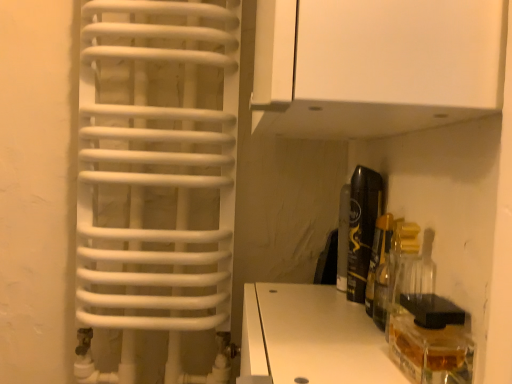
What do you see at coordinates (362, 228) in the screenshot? The height and width of the screenshot is (384, 512). I see `black glossy can at right, the 2th bottle positioned from the front` at bounding box center [362, 228].

This screenshot has height=384, width=512. Find the location of `white matte cabinet at upper center`. white matte cabinet at upper center is located at coordinates pos(375,65).

Between clear glass bottle at center right, acting as the 2th bottle starting from the back, and white matte cabinet at upper center, which one has less height?

With less height is clear glass bottle at center right, acting as the 2th bottle starting from the back.

From the image's perspective, is clear glass bottle at center right, acting as the 2th bottle starting from the back, positioned above or below white matte cabinet at upper center?

clear glass bottle at center right, acting as the 2th bottle starting from the back, is below white matte cabinet at upper center.

From a real-world perspective, which is physically above, white matte cabinet at upper center or black glossy can at right, which appears as the 1th bottle when viewed from the back?

In real-world perspective, white matte cabinet at upper center is above.

In the scene shown: From the image's perspective, is white matte cabinet at upper center above or below black glossy can at right, the 2th bottle positioned from the front?

white matte cabinet at upper center is above black glossy can at right, the 2th bottle positioned from the front.

Can you tell me how much white matte cabinet at upper center and black glossy can at right, the 2th bottle positioned from the front, differ in facing direction?

There is a 0.803-degree angle between the facing directions of white matte cabinet at upper center and black glossy can at right, the 2th bottle positioned from the front.

Considering the relative sizes of black glossy can at right, the 2th bottle positioned from the front, and white matte cabinet at upper center in the image provided, is black glossy can at right, the 2th bottle positioned from the front, taller than white matte cabinet at upper center?

No.

Is point (370, 173) closer to viewer compared to point (506, 14)?

No, it is not.

Considering the sizes of objects black glossy can at right, the 2th bottle positioned from the front, and white matte cabinet at upper center in the image provided, who is thinner, black glossy can at right, the 2th bottle positioned from the front, or white matte cabinet at upper center?

With smaller width is black glossy can at right, the 2th bottle positioned from the front.

From a real-world perspective, between black glossy can at right, which appears as the 1th bottle when viewed from the back, and white matte cabinet at upper center, who is vertically higher?

From a 3D spatial view, white matte cabinet at upper center is above.

Consider the image. Does clear glass bottle at center right, which is the first bottle in front-to-back order, have a greater height compared to black glossy can at right, which appears as the 1th bottle when viewed from the back?

No, clear glass bottle at center right, which is the first bottle in front-to-back order, is not taller than black glossy can at right, which appears as the 1th bottle when viewed from the back.

The height and width of the screenshot is (384, 512). Find the location of `bottle on the right of black glossy can at right, the 2th bottle positioned from the front`. bottle on the right of black glossy can at right, the 2th bottle positioned from the front is located at coordinates (400, 264).

How far apart are clear glass bottle at center right, acting as the 2th bottle starting from the back, and black glossy can at right, the 2th bottle positioned from the front?

clear glass bottle at center right, acting as the 2th bottle starting from the back, and black glossy can at right, the 2th bottle positioned from the front, are 3.21 inches apart.

Is clear glass bottle at center right, acting as the 2th bottle starting from the back, aimed at black glossy can at right, which appears as the 1th bottle when viewed from the back?

No, clear glass bottle at center right, acting as the 2th bottle starting from the back, is not aimed at black glossy can at right, which appears as the 1th bottle when viewed from the back.

From a real-world perspective, is white matte cabinet at upper center located beneath clear glass bottle at center right, which is the first bottle in front-to-back order?

No.

Which is in front, white matte cabinet at upper center or clear glass bottle at center right, which is the first bottle in front-to-back order?

white matte cabinet at upper center.

Where is `cabinetry located on the left of clear glass bottle at center right, acting as the 2th bottle starting from the back`? cabinetry located on the left of clear glass bottle at center right, acting as the 2th bottle starting from the back is located at coordinates (375, 65).

Is white matte cabinet at upper center with clear glass bottle at center right, which is the first bottle in front-to-back order?

There is a gap between white matte cabinet at upper center and clear glass bottle at center right, which is the first bottle in front-to-back order.

Between black glossy can at right, the 2th bottle positioned from the front, and clear glass bottle at center right, acting as the 2th bottle starting from the back, which one is positioned in front?

Positioned in front is clear glass bottle at center right, acting as the 2th bottle starting from the back.

Based on the photo, does black glossy can at right, the 2th bottle positioned from the front, turn towards clear glass bottle at center right, acting as the 2th bottle starting from the back?

No.

Considering the relative positions of black glossy can at right, which appears as the 1th bottle when viewed from the back, and clear glass bottle at center right, which is the first bottle in front-to-back order, in the image provided, is black glossy can at right, which appears as the 1th bottle when viewed from the back, to the left of clear glass bottle at center right, which is the first bottle in front-to-back order, from the viewer's perspective?

Indeed, black glossy can at right, which appears as the 1th bottle when viewed from the back, is positioned on the left side of clear glass bottle at center right, which is the first bottle in front-to-back order.

Identify the location of the 2nd bottle below the white matte cabinet at upper center (from the image's perspective). This screenshot has width=512, height=384. (400, 264).

Locate an element on the screen. This screenshot has width=512, height=384. bottle that is the 1st one below the white matte cabinet at upper center (from a real-world perspective) is located at coordinates (362, 228).

Which object lies nearer to the anchor point black glossy can at right, which appears as the 1th bottle when viewed from the back, clear glass bottle at center right, acting as the 2th bottle starting from the back, or white matte cabinet at upper center?

Among the two, clear glass bottle at center right, acting as the 2th bottle starting from the back, is located nearer to black glossy can at right, which appears as the 1th bottle when viewed from the back.

Estimate the real-world distances between objects in this image. Which object is further from clear glass bottle at center right, acting as the 2th bottle starting from the back, black glossy can at right, which appears as the 1th bottle when viewed from the back, or white matte cabinet at upper center?

Based on the image, white matte cabinet at upper center appears to be further to clear glass bottle at center right, acting as the 2th bottle starting from the back.

Which object lies further to the anchor point clear glass bottle at center right, acting as the 2th bottle starting from the back, white matte cabinet at upper center or black glossy can at right, which appears as the 1th bottle when viewed from the back?

Among the two, white matte cabinet at upper center is located further to clear glass bottle at center right, acting as the 2th bottle starting from the back.

Which object lies further to the anchor point black glossy can at right, the 2th bottle positioned from the front, white matte cabinet at upper center or clear glass bottle at center right, which is the first bottle in front-to-back order?

Among the two, white matte cabinet at upper center is located further to black glossy can at right, the 2th bottle positioned from the front.

Looking at the image, which one is located further to white matte cabinet at upper center, clear glass bottle at center right, acting as the 2th bottle starting from the back, or black glossy can at right, the 2th bottle positioned from the front?

clear glass bottle at center right, acting as the 2th bottle starting from the back, is further to white matte cabinet at upper center.

Estimate the real-world distances between objects in this image. Which object is further from white matte cabinet at upper center, black glossy can at right, the 2th bottle positioned from the front, or clear glass bottle at center right, which is the first bottle in front-to-back order?

Based on the image, clear glass bottle at center right, which is the first bottle in front-to-back order, appears to be further to white matte cabinet at upper center.

You are a GUI agent. You are given a task and a screenshot of the screen. Output one action in this format:
    pyautogui.click(x=<x>, y=<y>)
    Task: Click on the bottle between white matte cabinet at upper center and clear glass bottle at center right, acting as the 2th bottle starting from the back, in the up-down direction
    This screenshot has width=512, height=384.
    Given the screenshot: What is the action you would take?
    pyautogui.click(x=362, y=228)